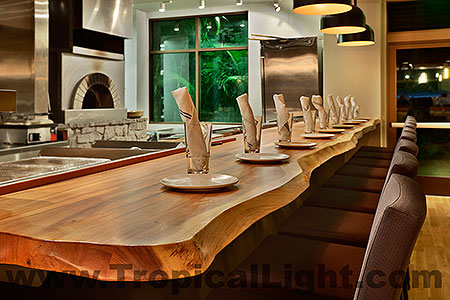
You are a GUI agent. You are given a task and a screenshot of the screen. Output one action in this format:
    pyautogui.click(x=<x>, y=<y>)
    Task: Click on the counter
    
    Given the screenshot: What is the action you would take?
    click(273, 175)